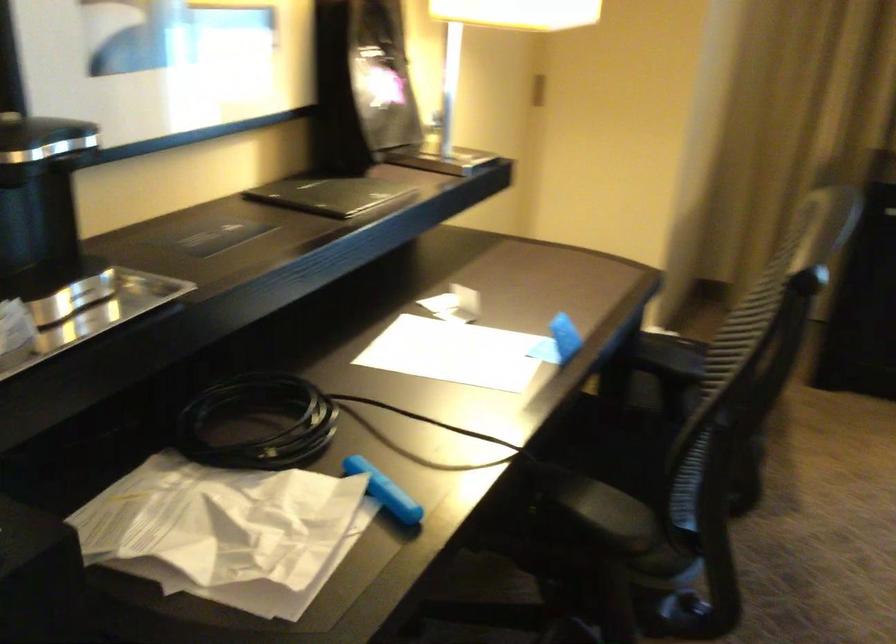
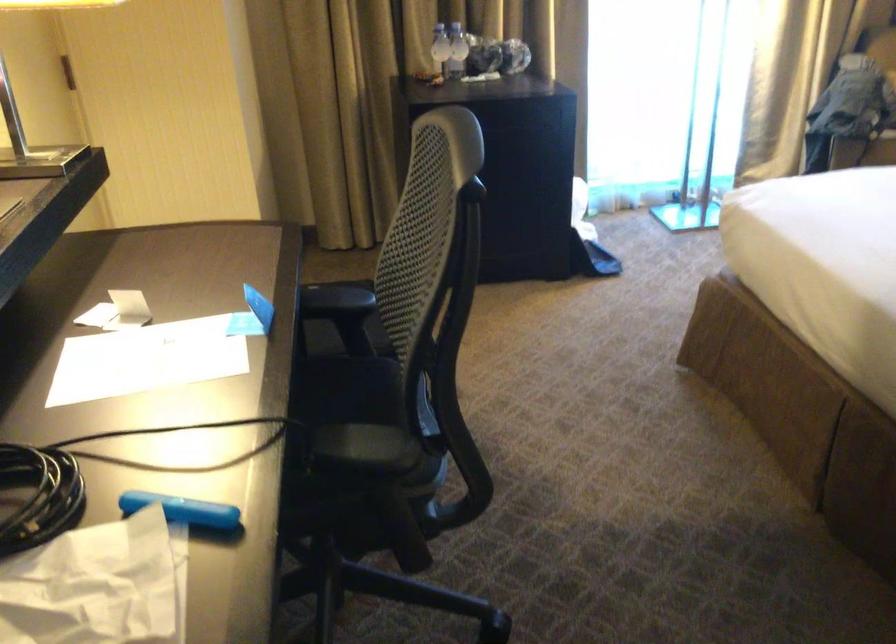
Question: The images are taken continuously from a first-person perspective. In which direction is your viewpoint rotating?

Choices:
 (A) Left
 (B) Right
 (C) Up
 (D) Down

Answer: (B)